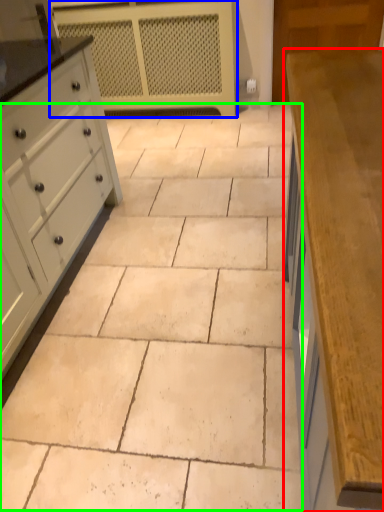
Question: Considering the real-world distances, which object is closest to countertop (highlighted by a red box)? appliance (highlighted by a blue box) or ceramic tile (highlighted by a green box).

Choices:
 (A) appliance
 (B) ceramic tile

Answer: (B)